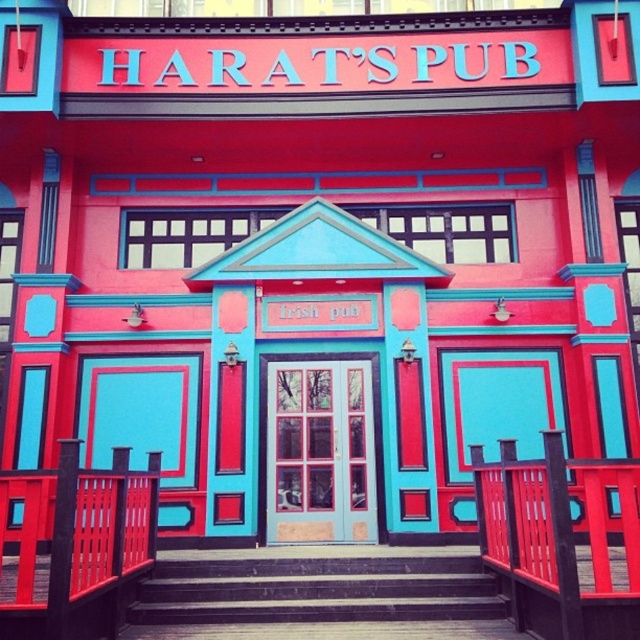
You are standing in front of Harat Pub and want to take a photo of the entrance. The entrance has a point at coordinate point (465, 589). If your camera has a focal length of 50mm and you want to focus on that point, what distance should you set your camera to?

The point at coordinate point (465, 589) is 6.36 meters away from the camera, so you should set the camera distance to 6.36 meters to focus on that point.

You are a delivery person carrying a large package that is 3 meters wide. You arrive at Harat Pub and see the dark gray concrete stairs at center and the matte teal door at center. Which one can accommodate your package in terms of width?

The dark gray concrete stairs at center is wider than the matte teal door at center, so the package can pass through the dark gray concrete stairs at center.

You are a painter who needs to choose between painting the wooden textured rail at center and the matte teal door at center first. Which object requires more paint due to its larger surface area?

The matte teal door at center requires more paint because its width is greater than the wooden textured rail at center, making its surface area larger.